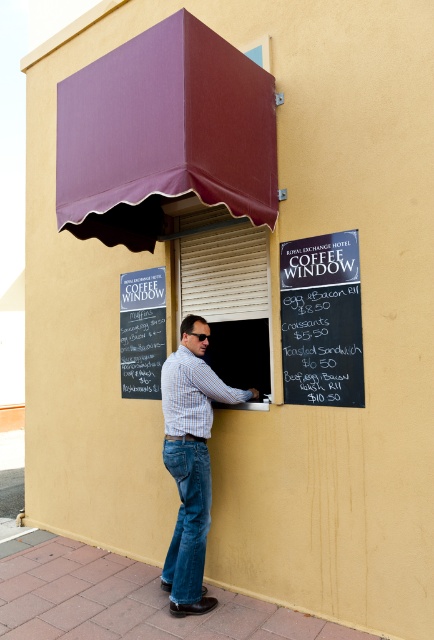
Does denim jeans at center have a lesser height compared to black chalkboard menu at center?

Result: Yes.

In order to click on denim jeans at center in this screenshot , I will do `click(187, 518)`.

How far apart are beige/textured roller shutter at center and black chalkboard menu at center?

The distance of beige/textured roller shutter at center from black chalkboard menu at center is 17.56 inches.

From the picture: Can you confirm if beige/textured roller shutter at center is positioned to the left of black chalkboard menu at center?

No, beige/textured roller shutter at center is not to the left of black chalkboard menu at center.

Where is `beige/textured roller shutter at center`? The width and height of the screenshot is (434, 640). beige/textured roller shutter at center is located at coordinates (227, 292).

Identify the location of beige/textured roller shutter at center. The height and width of the screenshot is (640, 434). (227, 292).

Can you confirm if beige/textured roller shutter at center is positioned above light blue plaid shirt at center?

Yes.

Which is behind, point (201, 285) or point (200, 595)?

The point (201, 285) is behind.

You are a GUI agent. You are given a task and a screenshot of the screen. Output one action in this format:
    pyautogui.click(x=<x>, y=<y>)
    Task: Click on the beige/textured roller shutter at center
    
    Given the screenshot: What is the action you would take?
    pyautogui.click(x=227, y=292)